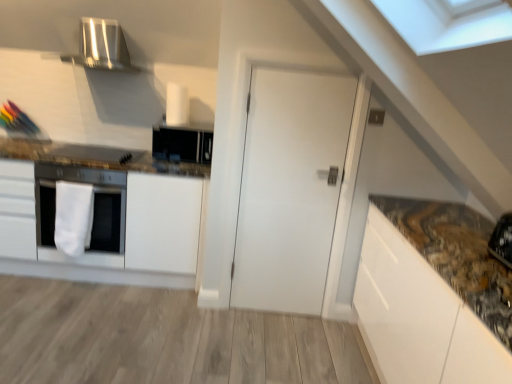
At what (x,y) coordinates should I click in order to perform the action: click on free location above white fabric towel at left (from a real-world perspective). Please return your answer as a coordinate pair (x, y). Looking at the image, I should click on (73, 177).